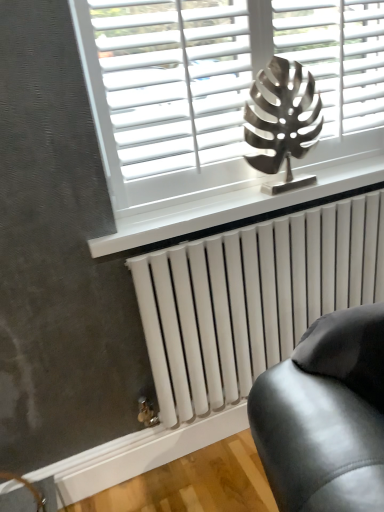
Question: Considering the relative sizes of white glossy radiator at lower center and white metallic radiator at lower center in the image provided, is white glossy radiator at lower center bigger than white metallic radiator at lower center?

Choices:
 (A) yes
 (B) no

Answer: (B)

Question: Is white glossy radiator at lower center beside white metallic radiator at lower center?

Choices:
 (A) no
 (B) yes

Answer: (A)

Question: Is white glossy radiator at lower center at the right side of white metallic radiator at lower center?

Choices:
 (A) no
 (B) yes

Answer: (A)

Question: Is white metallic radiator at lower center completely or partially inside white glossy radiator at lower center?

Choices:
 (A) yes
 (B) no

Answer: (B)

Question: Is white glossy radiator at lower center completely or partially outside of white metallic radiator at lower center?

Choices:
 (A) no
 (B) yes

Answer: (B)

Question: From a real-world perspective, is white glossy radiator at lower center physically above white metallic radiator at lower center?

Choices:
 (A) no
 (B) yes

Answer: (B)

Question: Considering the relative sizes of white glossy radiator at lower center and metallic leaf at center in the image provided, is white glossy radiator at lower center smaller than metallic leaf at center?

Choices:
 (A) yes
 (B) no

Answer: (A)

Question: Does white glossy radiator at lower center lie in front of metallic leaf at center?

Choices:
 (A) no
 (B) yes

Answer: (A)

Question: Is white glossy radiator at lower center positioned with its back to metallic leaf at center?

Choices:
 (A) yes
 (B) no

Answer: (B)

Question: Does white glossy radiator at lower center turn towards metallic leaf at center?

Choices:
 (A) no
 (B) yes

Answer: (A)

Question: Can you confirm if white glossy radiator at lower center is positioned to the left of metallic leaf at center?

Choices:
 (A) no
 (B) yes

Answer: (A)

Question: From a real-world perspective, is white glossy radiator at lower center positioned under metallic leaf at center based on gravity?

Choices:
 (A) no
 (B) yes

Answer: (B)

Question: Does metallic leaf at center come in front of white glossy radiator at lower center?

Choices:
 (A) yes
 (B) no

Answer: (A)